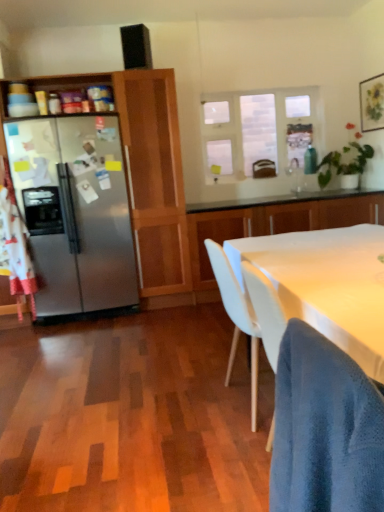
Question: Is green leafy plant at upper right not within white glossy cabinet at center, arranged as the first cabinetry when viewed from the right?

Choices:
 (A) no
 (B) yes

Answer: (B)

Question: Is green leafy plant at upper right next to white glossy cabinet at center, positioned as the second cabinetry in left-to-right order?

Choices:
 (A) yes
 (B) no

Answer: (B)

Question: From a real-world perspective, is green leafy plant at upper right positioned under white glossy cabinet at center, positioned as the second cabinetry in left-to-right order, based on gravity?

Choices:
 (A) yes
 (B) no

Answer: (B)

Question: Considering the relative sizes of green leafy plant at upper right and white glossy cabinet at center, arranged as the first cabinetry when viewed from the right, in the image provided, is green leafy plant at upper right taller than white glossy cabinet at center, arranged as the first cabinetry when viewed from the right,?

Choices:
 (A) no
 (B) yes

Answer: (A)

Question: From a real-world perspective, is green leafy plant at upper right physically above white glossy cabinet at center, arranged as the first cabinetry when viewed from the right?

Choices:
 (A) no
 (B) yes

Answer: (B)

Question: From the image's perspective, does green leafy plant at upper right appear lower than white glossy cabinet at center, arranged as the first cabinetry when viewed from the right?

Choices:
 (A) no
 (B) yes

Answer: (A)

Question: Does white matte table at center have a greater height compared to blue textured fabric chair at lower right?

Choices:
 (A) yes
 (B) no

Answer: (A)

Question: From a real-world perspective, is white matte table at center under blue textured fabric chair at lower right?

Choices:
 (A) yes
 (B) no

Answer: (A)

Question: Is white matte table at center not inside blue textured fabric chair at lower right?

Choices:
 (A) no
 (B) yes

Answer: (B)

Question: Can you confirm if white matte table at center is wider than blue textured fabric chair at lower right?

Choices:
 (A) yes
 (B) no

Answer: (A)

Question: Is blue textured fabric chair at lower right inside white matte table at center?

Choices:
 (A) yes
 (B) no

Answer: (B)

Question: Does white matte table at center turn towards blue textured fabric chair at lower right?

Choices:
 (A) no
 (B) yes

Answer: (A)

Question: From the image's perspective, is green leafy plant at upper right over clear glass window at upper center?

Choices:
 (A) no
 (B) yes

Answer: (A)